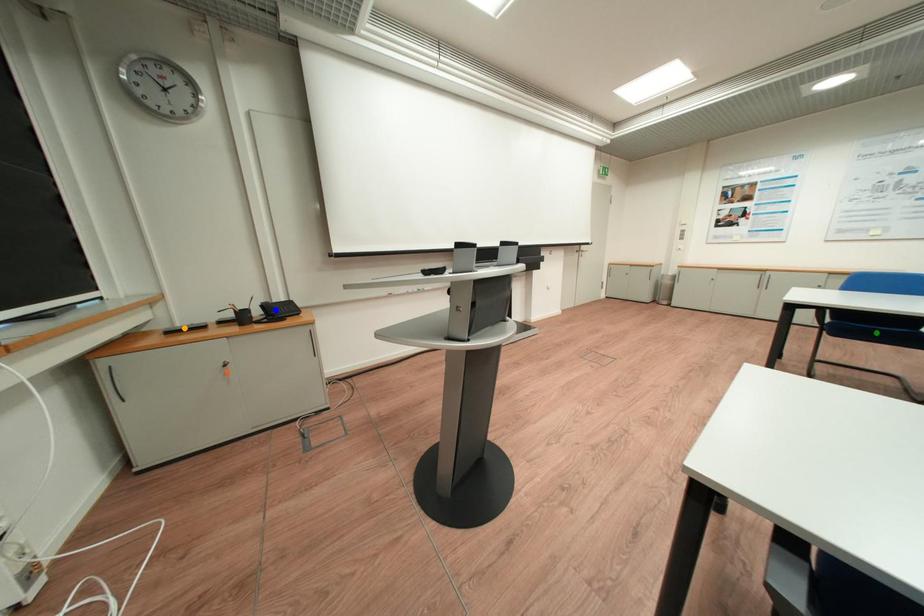
Order these from nearest to farthest:
orange point | green point | blue point

orange point → green point → blue point